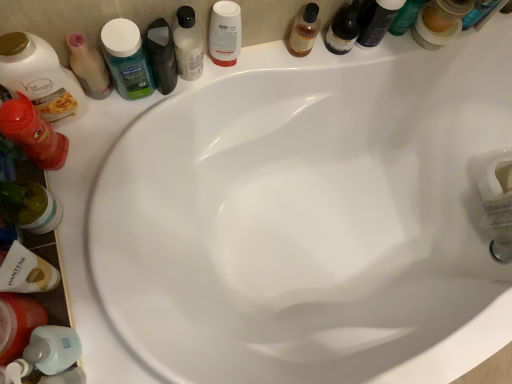
Question: Considering the relative sizes of matte black bottle at upper right, which appears as the eighth toiletry when viewed from the left, and translucent plastic mouthwash at lower left, the first mouthwash ordered from the bottom, in the image provided, is matte black bottle at upper right, which appears as the eighth toiletry when viewed from the left, smaller than translucent plastic mouthwash at lower left, the first mouthwash ordered from the bottom,?

Choices:
 (A) no
 (B) yes

Answer: (B)

Question: From the image's perspective, does matte black bottle at upper right, which appears as the eighth toiletry when viewed from the left, appear lower than translucent plastic mouthwash at lower left, the first mouthwash ordered from the bottom?

Choices:
 (A) no
 (B) yes

Answer: (A)

Question: Is matte black bottle at upper right, which appears as the eighth toiletry when viewed from the left, touching translucent plastic mouthwash at lower left, placed as the sixth mouthwash when sorted from right to left?

Choices:
 (A) no
 (B) yes

Answer: (A)

Question: Is matte black bottle at upper right, the 1th toiletry positioned from the right, to the left of translucent plastic mouthwash at lower left, which is the 6th mouthwash in top-to-bottom order, from the viewer's perspective?

Choices:
 (A) no
 (B) yes

Answer: (A)

Question: From a real-world perspective, is matte black bottle at upper right, which appears as the eighth toiletry when viewed from the left, located higher than translucent plastic mouthwash at lower left, the 1th mouthwash viewed from the left?

Choices:
 (A) yes
 (B) no

Answer: (B)

Question: In terms of size, does translucent plastic pump bottle at lower left, which is counted as the 4th toiletry, starting from the left, appear bigger or smaller than matte black bottle at upper right, which appears as the eighth toiletry when viewed from the left?

Choices:
 (A) big
 (B) small

Answer: (B)

Question: From the image's perspective, is translucent plastic pump bottle at lower left, which is counted as the 4th toiletry, starting from the left, above or below matte black bottle at upper right, the 1th toiletry positioned from the right?

Choices:
 (A) below
 (B) above

Answer: (A)

Question: Is translucent plastic pump bottle at lower left, placed as the 5th toiletry when sorted from right to left, to the left or to the right of matte black bottle at upper right, the 1th toiletry positioned from the right, in the image?

Choices:
 (A) right
 (B) left

Answer: (B)

Question: In the image, is translucent plastic pump bottle at lower left, which is counted as the 4th toiletry, starting from the left, positioned in front of or behind matte black bottle at upper right, which appears as the eighth toiletry when viewed from the left?

Choices:
 (A) front
 (B) behind

Answer: (A)

Question: Is matte white lotion at left, positioned as the 7th toiletry in right-to-left order, inside the boundaries of white matte bottle at upper center, which ranks as the 3th mouthwash in top-to-bottom order, or outside?

Choices:
 (A) inside
 (B) outside

Answer: (B)

Question: From the image's perspective, is matte white lotion at left, positioned as the 7th toiletry in right-to-left order, located above or below white matte bottle at upper center, marked as the third mouthwash in a right-to-left arrangement?

Choices:
 (A) below
 (B) above

Answer: (A)

Question: Based on their sizes in the image, would you say matte white lotion at left, positioned as the 7th toiletry in right-to-left order, is bigger or smaller than white matte bottle at upper center, which ranks as the 3th mouthwash in top-to-bottom order?

Choices:
 (A) small
 (B) big

Answer: (B)

Question: Looking at their shapes, would you say matte white lotion at left, positioned as the 7th toiletry in right-to-left order, is wider or thinner than white matte bottle at upper center, marked as the third mouthwash in a right-to-left arrangement?

Choices:
 (A) thin
 (B) wide

Answer: (B)

Question: Does point (28, 286) appear closer or farther from the camera than point (39, 160)?

Choices:
 (A) farther
 (B) closer

Answer: (B)

Question: Is white matte shampoo bottle at lower left, which appears as the 3th toiletry when viewed from the left, wider or thinner than rubberized red bottle at left, acting as the eighth toiletry starting from the right?

Choices:
 (A) thin
 (B) wide

Answer: (A)